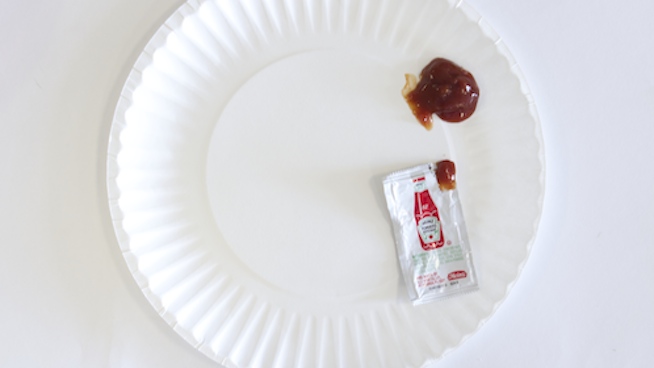
Locate an element on the screen. The height and width of the screenshot is (368, 654). paper plate edges is located at coordinates (108, 174), (543, 160), (443, 354), (192, 342), (186, 8), (464, 6).